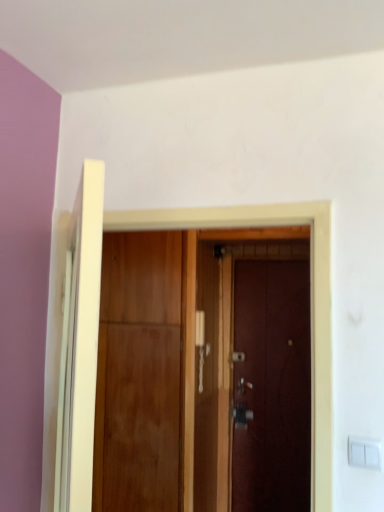
What is the approximate width of wooden door at center, the 2th door positioned from the back?

wooden door at center, the 2th door positioned from the back, is 23.97 inches in width.

Identify the location of wooden door at center, which ranks as the third door in back-to-front order. The width and height of the screenshot is (384, 512). (197, 301).

I want to click on wooden door at center, the 2th door positioned from the back, so (x=138, y=373).

Is wooden door at center, the 2th door when ordered from front to back, inside the boundaries of dark wood door at center, placed as the third door when sorted from front to back, or outside?

wooden door at center, the 2th door when ordered from front to back, lies outside dark wood door at center, placed as the third door when sorted from front to back.

Which object is positioned more to the left, wooden door at center, the 2th door positioned from the back, or dark wood door at center, which is the 1th door from back to front?

wooden door at center, the 2th door positioned from the back.

From the image's perspective, would you say wooden door at center, the 2th door when ordered from front to back, is positioned over dark wood door at center, which is the 1th door from back to front?

Yes, from the image's perspective, wooden door at center, the 2th door when ordered from front to back, is on top of dark wood door at center, which is the 1th door from back to front.

How distant is wooden door at center, the 2th door when ordered from front to back, from white plastic light switch at lower right?

wooden door at center, the 2th door when ordered from front to back, is 1.92 meters from white plastic light switch at lower right.

From a real-world perspective, who is located higher, wooden door at center, the 2th door positioned from the back, or white plastic light switch at lower right?

In real-world perspective, white plastic light switch at lower right is above.

Is wooden door at center, the 2th door when ordered from front to back, facing towards white plastic light switch at lower right?

No.

Considering the points (157, 314) and (358, 458), which point is in front, point (157, 314) or point (358, 458)?

The point (358, 458) is closer to the camera.

Would you say wooden door at center, which ranks as the third door in back-to-front order, is part of wooden door at center, the 2th door positioned from the back,'s contents?

No, wooden door at center, which ranks as the third door in back-to-front order, is not a part of wooden door at center, the 2th door positioned from the back.

Is wooden door at center, the 2th door positioned from the back, turned away from wooden door at center, which ranks as the third door in back-to-front order?

wooden door at center, the 2th door positioned from the back, does not have its back to wooden door at center, which ranks as the third door in back-to-front order.

From the image's perspective, which object appears higher, wooden door at center, the 2th door when ordered from front to back, or wooden door at center, which ranks as the third door in back-to-front order?

From the image's view, wooden door at center, which ranks as the third door in back-to-front order, is above.

Based on the photo, does wooden door at center, the 2th door when ordered from front to back, have a larger size compared to wooden door at center, which ranks as the third door in back-to-front order?

Indeed, wooden door at center, the 2th door when ordered from front to back, has a larger size compared to wooden door at center, which ranks as the third door in back-to-front order.

Is point (380, 456) closer to camera compared to point (273, 387)?

Yes, it is.

In the scene shown: Is white plastic light switch at lower right inside or outside of dark wood door at center, placed as the third door when sorted from front to back?

white plastic light switch at lower right is located beyond the bounds of dark wood door at center, placed as the third door when sorted from front to back.

Is white plastic light switch at lower right looking in the opposite direction of dark wood door at center, placed as the third door when sorted from front to back?

Correct, white plastic light switch at lower right is looking away from dark wood door at center, placed as the third door when sorted from front to back.

In terms of width, does white plastic light switch at lower right look wider or thinner when compared to dark wood door at center, placed as the third door when sorted from front to back?

Clearly, white plastic light switch at lower right has less width compared to dark wood door at center, placed as the third door when sorted from front to back.

Considering the positions of objects white plastic light switch at lower right and wooden door at center, which ranks as the third door in back-to-front order, in the image provided, who is more to the left, white plastic light switch at lower right or wooden door at center, which ranks as the third door in back-to-front order,?

wooden door at center, which ranks as the third door in back-to-front order, is more to the left.

Between white plastic light switch at lower right and wooden door at center, which ranks as the third door in back-to-front order, which one has less height?

With less height is white plastic light switch at lower right.

Which object is closer to the camera taking this photo, white plastic light switch at lower right or wooden door at center, which ranks as the third door in back-to-front order?

white plastic light switch at lower right is closer to the camera.

How far apart are white plastic light switch at lower right and wooden door at center, which ranks as the third door in back-to-front order?

A distance of 1.88 meters exists between white plastic light switch at lower right and wooden door at center, which ranks as the third door in back-to-front order.

From the image's perspective, between wooden door at center, which ranks as the third door in back-to-front order, and white plastic light switch at lower right, who is located below?

white plastic light switch at lower right, from the image's perspective.

Is wooden door at center, placed as the 1th door when sorted from front to back, spatially inside white plastic light switch at lower right, or outside of it?

wooden door at center, placed as the 1th door when sorted from front to back, is located beyond the bounds of white plastic light switch at lower right.

Consider the image. Is wooden door at center, which ranks as the third door in back-to-front order, not near white plastic light switch at lower right?

Yes, wooden door at center, which ranks as the third door in back-to-front order, and white plastic light switch at lower right are quite far apart.

Measure the distance from wooden door at center, placed as the 1th door when sorted from front to back, to white plastic light switch at lower right.

wooden door at center, placed as the 1th door when sorted from front to back, and white plastic light switch at lower right are 6.18 feet apart from each other.

Is white plastic light switch at lower right directly adjacent to wooden door at center, the 2th door when ordered from front to back?

No, white plastic light switch at lower right is not touching wooden door at center, the 2th door when ordered from front to back.

Who is taller, white plastic light switch at lower right or wooden door at center, the 2th door when ordered from front to back?

wooden door at center, the 2th door when ordered from front to back, is taller.

Which object is wider, white plastic light switch at lower right or wooden door at center, the 2th door when ordered from front to back?

wooden door at center, the 2th door when ordered from front to back, is wider.

From a real-world perspective, is white plastic light switch at lower right above or below wooden door at center, the 2th door positioned from the back?

In terms of real-world spatial position, white plastic light switch at lower right is above wooden door at center, the 2th door positioned from the back.

From the image's perspective, count 1st doors upward from the dark wood door at center, placed as the third door when sorted from front to back, and point to it. Please provide its 2D coordinates.

[(138, 373)]

Which door is the 2nd one when counting from the back of the white plastic light switch at lower right? Please provide its 2D coordinates.

[(138, 373)]

When comparing their distances from white plastic light switch at lower right, does wooden door at center, the 2th door when ordered from front to back, or dark wood door at center, which is the 1th door from back to front, seem closer?

Among the two, wooden door at center, the 2th door when ordered from front to back, is located nearer to white plastic light switch at lower right.

Which object lies nearer to the anchor point white plastic light switch at lower right, dark wood door at center, which is the 1th door from back to front, or wooden door at center, placed as the 1th door when sorted from front to back?

wooden door at center, placed as the 1th door when sorted from front to back.

From the image, which object appears to be nearer to wooden door at center, the 2th door positioned from the back, white plastic light switch at lower right or wooden door at center, which ranks as the third door in back-to-front order?

wooden door at center, which ranks as the third door in back-to-front order, is positioned closer to the anchor wooden door at center, the 2th door positioned from the back.

When comparing their distances from dark wood door at center, placed as the third door when sorted from front to back, does wooden door at center, the 2th door when ordered from front to back, or wooden door at center, which ranks as the third door in back-to-front order, seem further?

The object further to dark wood door at center, placed as the third door when sorted from front to back, is wooden door at center, the 2th door when ordered from front to back.

From the image, which object appears to be farther from white plastic light switch at lower right, dark wood door at center, which is the 1th door from back to front, or wooden door at center, the 2th door when ordered from front to back?

dark wood door at center, which is the 1th door from back to front, is further to white plastic light switch at lower right.

Based on their spatial positions, is wooden door at center, which ranks as the third door in back-to-front order, or wooden door at center, the 2th door when ordered from front to back, closer to white plastic light switch at lower right?

wooden door at center, which ranks as the third door in back-to-front order, lies closer to white plastic light switch at lower right than the other object.

Which object lies nearer to the anchor point wooden door at center, which ranks as the third door in back-to-front order, wooden door at center, the 2th door positioned from the back, or dark wood door at center, which is the 1th door from back to front?

The object closer to wooden door at center, which ranks as the third door in back-to-front order, is dark wood door at center, which is the 1th door from back to front.

Considering their positions, is wooden door at center, placed as the 1th door when sorted from front to back, positioned closer to wooden door at center, the 2th door when ordered from front to back, than white plastic light switch at lower right?

Based on the image, wooden door at center, placed as the 1th door when sorted from front to back, appears to be nearer to wooden door at center, the 2th door when ordered from front to back.

At what (x,y) coordinates should I click in order to perform the action: click on door positioned between white plastic light switch at lower right and wooden door at center, the 2th door when ordered from front to back, from near to far. Please return your answer as a coordinate pair (x, y). The height and width of the screenshot is (512, 384). Looking at the image, I should click on (197, 301).

Identify the location of door between wooden door at center, which ranks as the third door in back-to-front order, and dark wood door at center, which is the 1th door from back to front, in the front-back direction. (138, 373).